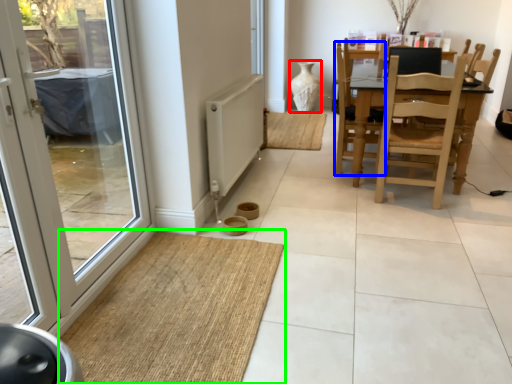
Question: Based on their relative distances, which object is farther from vase (highlighted by a red box)? Choose from swivel chair (highlighted by a blue box) and doormat (highlighted by a green box).

Choices:
 (A) swivel chair
 (B) doormat

Answer: (B)